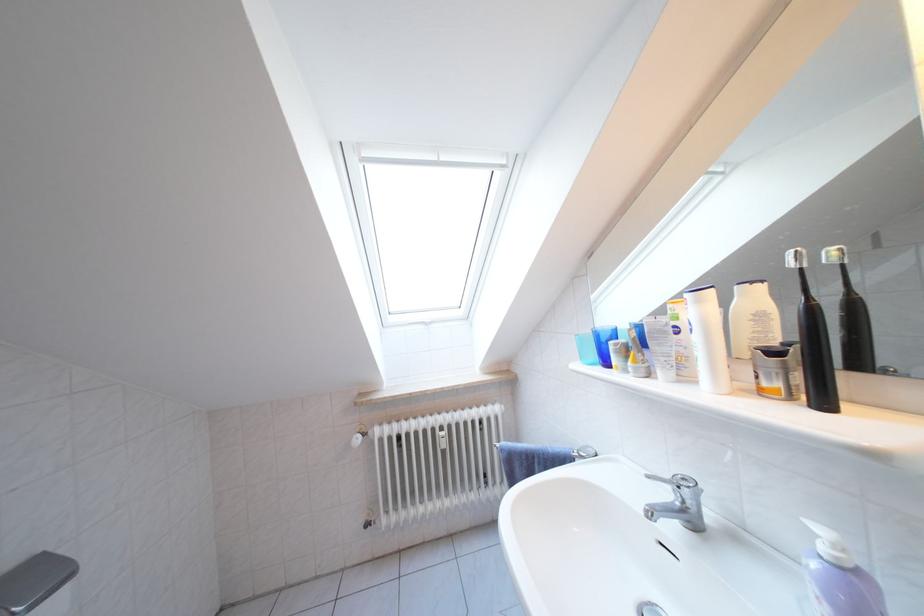
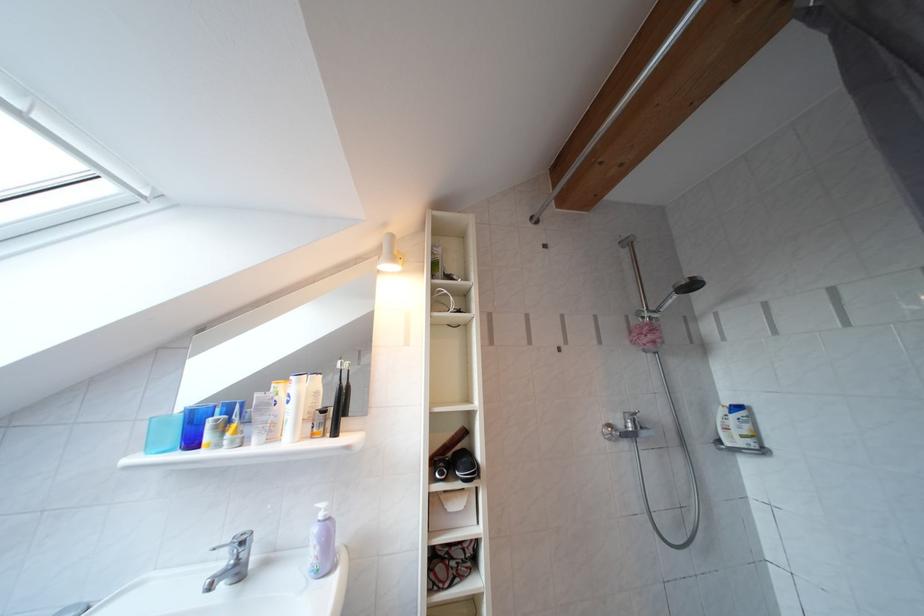
The images are taken continuously from a first-person perspective. In which direction is your viewpoint rotating?

The rotation direction of the camera is right-up.